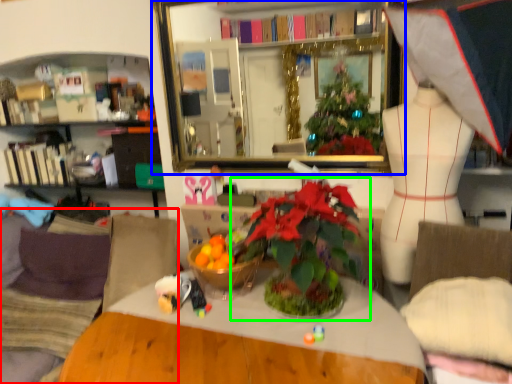
Question: Based on their relative distances, which object is nearer to couch (highlighted by a red box)? Choose from mirror (highlighted by a blue box) and houseplant (highlighted by a green box).

Choices:
 (A) mirror
 (B) houseplant

Answer: (B)